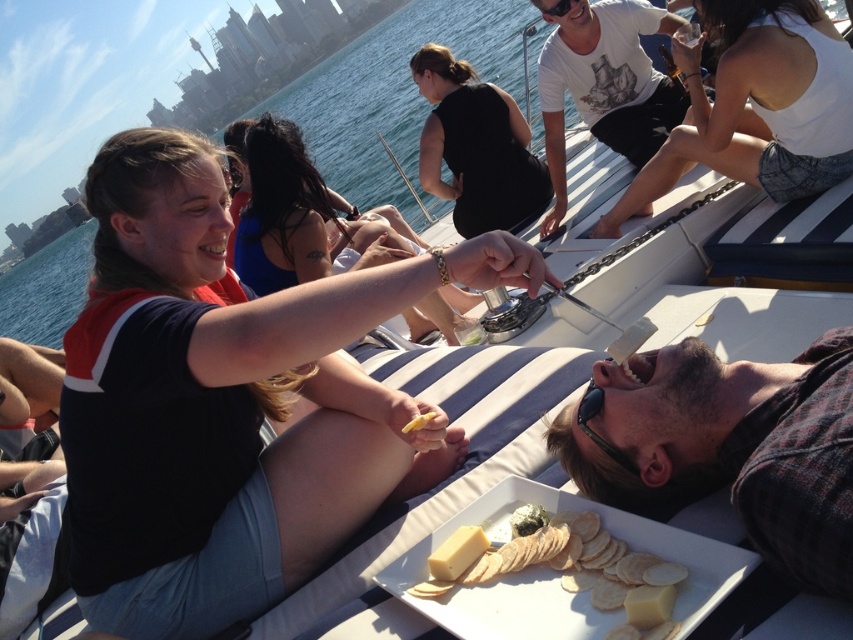
Question: Estimate the real-world distances between objects in this image. Which object is closer to the white creamy cheese at center?

Choices:
 (A) white cracker at lower right
 (B) white denim shorts at upper center
 (C) black matte tank top at upper center
 (D) beige fabric man at lower right

Answer: (A)

Question: Which point is farther from the camera taking this photo?

Choices:
 (A) (666, 564)
 (B) (457, 547)
 (C) (444, 330)
 (D) (705, 401)

Answer: (C)

Question: Is black matte shirt at center above black matte tank top at upper center?

Choices:
 (A) no
 (B) yes

Answer: (A)

Question: Is white printed t-shirt at upper right above black matte tank top at upper center?

Choices:
 (A) yes
 (B) no

Answer: (A)

Question: Is white cracker at lower right positioned behind white creamy cheese at center?

Choices:
 (A) yes
 (B) no

Answer: (B)

Question: Which object is positioned closest to the white cracker at lower right?

Choices:
 (A) white denim shorts at upper center
 (B) beige fabric man at lower right
 (C) matte black tank top at center

Answer: (B)